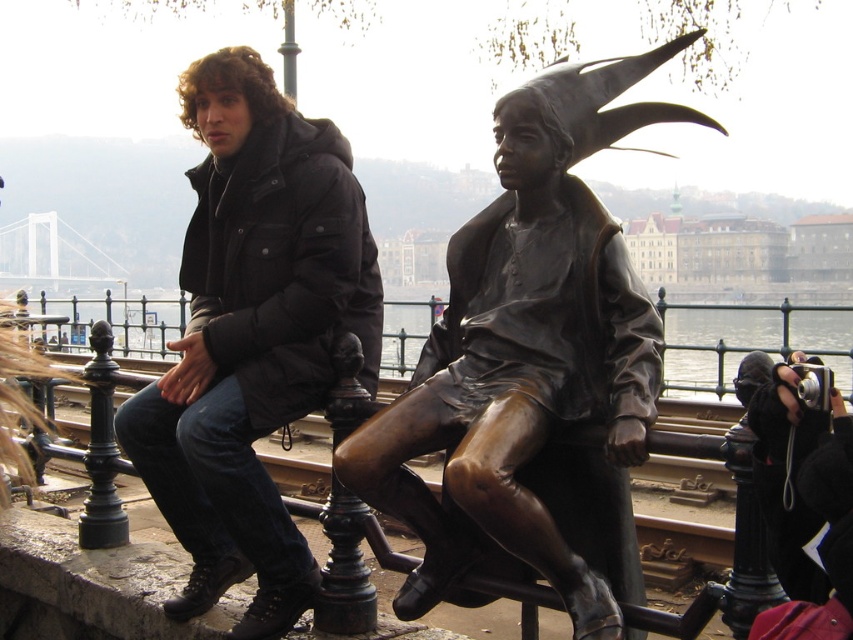
From the picture: Between black matte jacket at left and glossy metallic water at center, which one appears on the left side from the viewer's perspective?

Positioned to the left is glossy metallic water at center.

Which of these two, black matte jacket at left or glossy metallic water at center, stands taller?

With more height is black matte jacket at left.

Who is more distant from viewer, (187, 234) or (764, 316)?

The point (764, 316) is more distant.

Find the location of a particular element. The image size is (853, 640). black matte jacket at left is located at coordinates (252, 336).

Can you confirm if bronze statue at center is taller than black matte jacket at left?

In fact, bronze statue at center may be shorter than black matte jacket at left.

Which is behind, point (631, 445) or point (244, 614)?

The point (244, 614) is behind.

I want to click on bronze statue at center, so click(527, 349).

Is point (585, 99) closer to camera compared to point (173, 324)?

Yes, it is in front of point (173, 324).

Who is taller, bronze statue at center or glossy metallic water at center?

Standing taller between the two is bronze statue at center.

Is point (531, 218) behind point (677, 308)?

That is False.

Locate an element on the screen. The image size is (853, 640). bronze statue at center is located at coordinates 527,349.